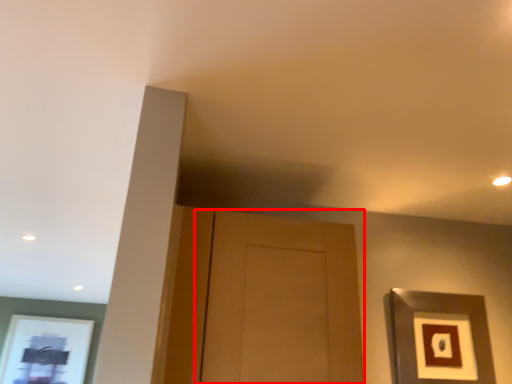
Question: From the image, what is the correct spatial relationship of door (annotated by the red box) in relation to picture frame?

Choices:
 (A) left
 (B) right

Answer: (A)